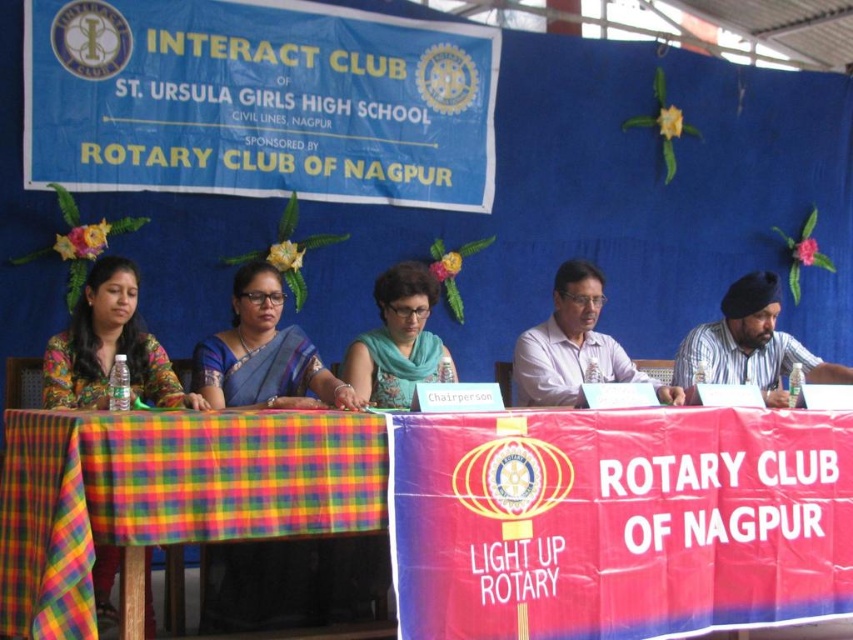
Question: Which point is farther to the camera?

Choices:
 (A) (48, 362)
 (B) (756, 360)
 (C) (577, 384)

Answer: (B)

Question: Can you confirm if plaid fabric table at center is positioned below matte floral dress at left?

Choices:
 (A) yes
 (B) no

Answer: (A)

Question: Does plaid fabric table at center have a larger size compared to white shirt at center?

Choices:
 (A) yes
 (B) no

Answer: (A)

Question: Which object appears closest to the camera in this image?

Choices:
 (A) matte blue scarf at center
 (B) striped shirt at right
 (C) plaid fabric table at center

Answer: (C)

Question: Considering the relative positions of matte floral dress at left and white shirt at center in the image provided, where is matte floral dress at left located with respect to white shirt at center?

Choices:
 (A) above
 (B) below

Answer: (B)

Question: Which object appears closest to the camera in this image?

Choices:
 (A) blue silk saree at center
 (B) plaid fabric tablecloth at center
 (C) striped shirt at right

Answer: (B)